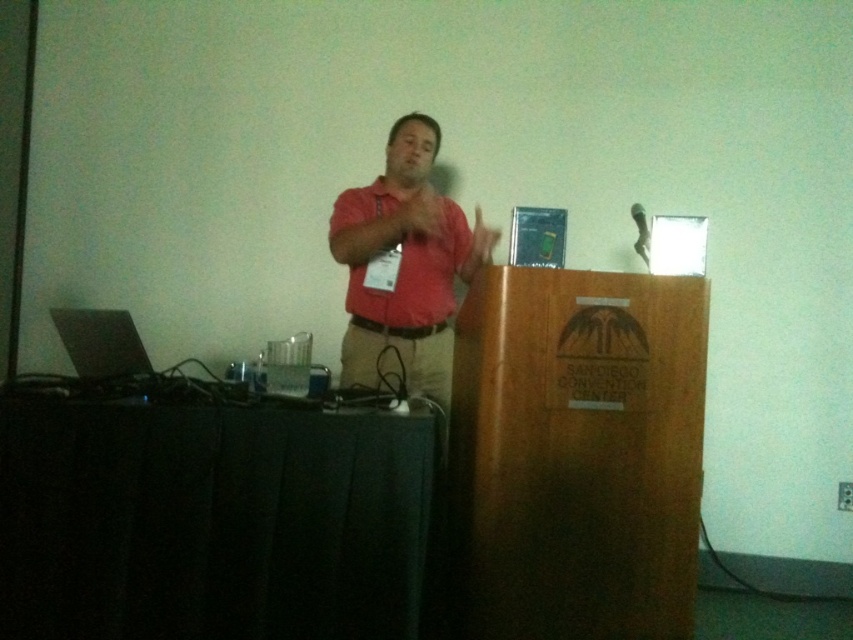
Question: Can you confirm if matte pink shirt at center is smaller than matte red shirt at center?

Choices:
 (A) yes
 (B) no

Answer: (B)

Question: Which of these objects is positioned farthest from the matte pink shirt at upper center?

Choices:
 (A) matte pink hand at center
 (B) matte pink shirt at center
 (C) matte red shirt at center

Answer: (A)

Question: Which object appears closest to the camera in this image?

Choices:
 (A) matte pink shirt at upper center
 (B) matte red shirt at center

Answer: (A)

Question: Does matte red shirt at center appear over matte pink hand at center?

Choices:
 (A) yes
 (B) no

Answer: (A)

Question: Does matte pink shirt at center have a smaller size compared to matte pink hand at center?

Choices:
 (A) no
 (B) yes

Answer: (A)

Question: Which object appears closest to the camera in this image?

Choices:
 (A) matte pink hand at center
 (B) matte red shirt at center
 (C) matte pink shirt at upper center
 (D) matte pink shirt at center

Answer: (A)